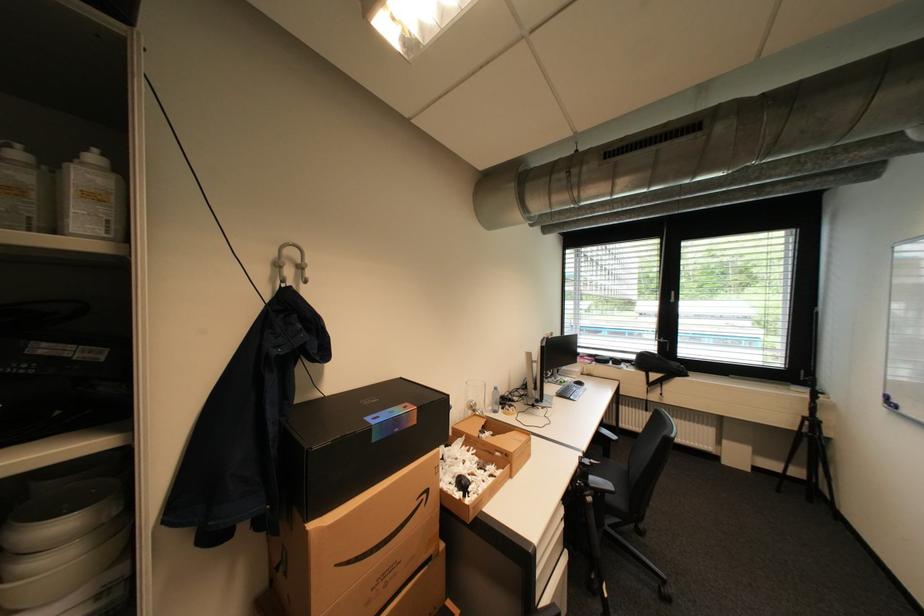
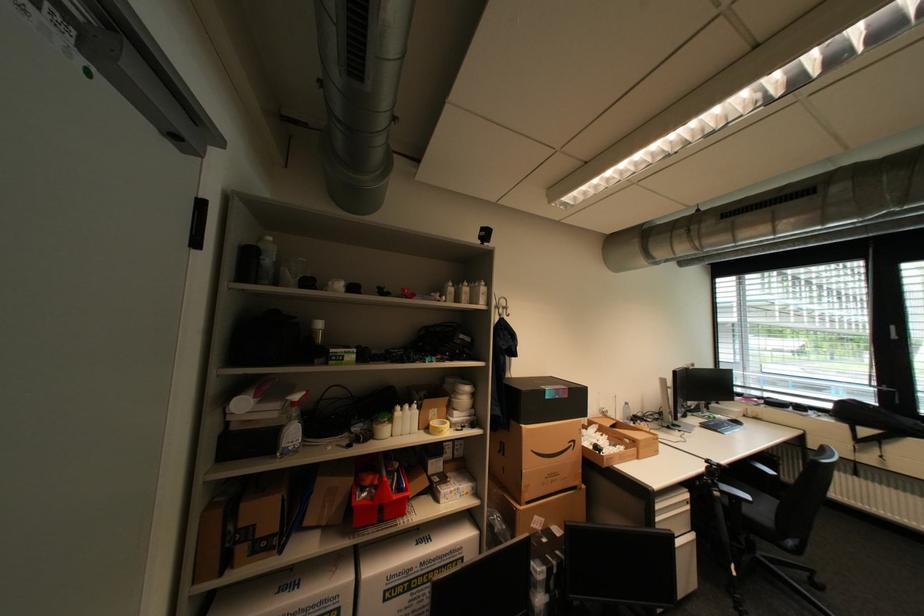
Question: Which direction would the cameraman need to move to produce the second image? Reply with the corresponding letter.

Choices:
 (A) Left
 (B) Right
 (C) Forward
 (D) Backward

Answer: (D)